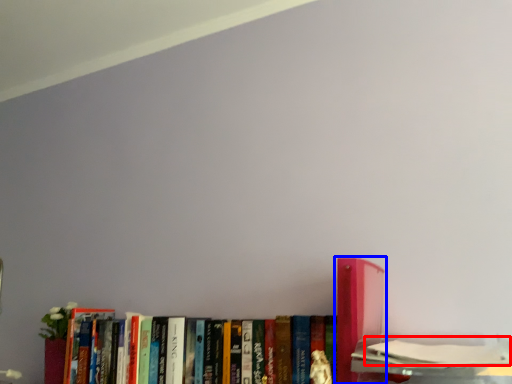
Question: Among these objects, which one is farthest to the camera, book (highlighted by a red box) or book (highlighted by a blue box)?

Choices:
 (A) book
 (B) book

Answer: (B)